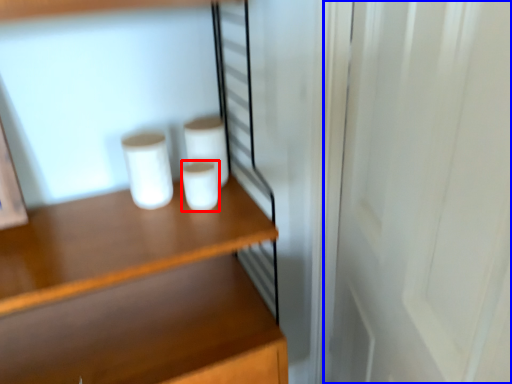
Question: Which point is closer to the camera, paper towel (highlighted by a red box) or screen door (highlighted by a blue box)?

Choices:
 (A) paper towel
 (B) screen door

Answer: (B)